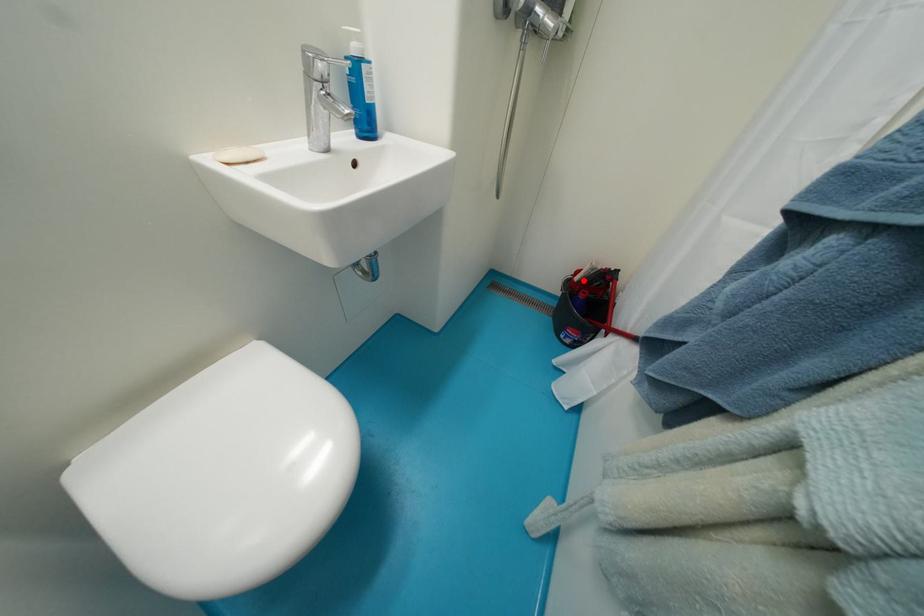
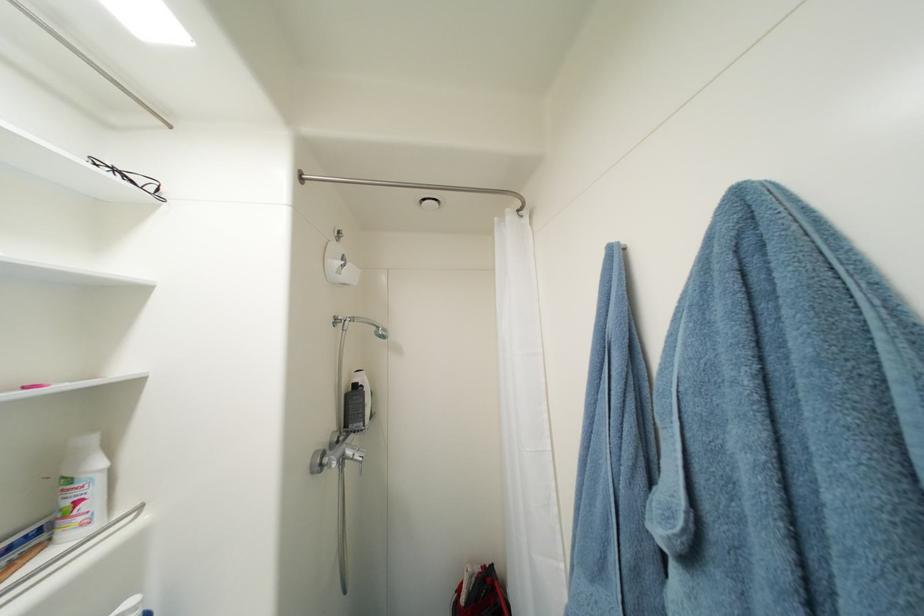
Question: I am providing you with two images of the same scene from different viewpoints. In image1, a red point is highlighted. Considering the same 3D point in image2, which of the following is correct?

Choices:
 (A) It is closer
 (B) It is farther

Answer: (B)